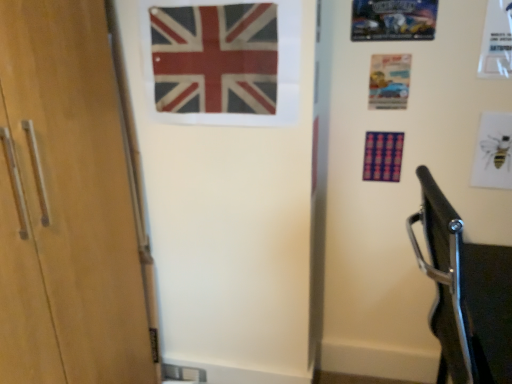
Question: In the image, is metallic silver car at upper right, which is counted as the third postcard, starting from the bottom, on the left side or the right side of white paper bee at upper right, acting as the 3th postcard starting from the left?

Choices:
 (A) right
 (B) left

Answer: (B)

Question: Is metallic silver car at upper right, which is counted as the third postcard, starting from the bottom, taller or shorter than white paper bee at upper right, positioned as the first postcard in bottom-to-top order?

Choices:
 (A) short
 (B) tall

Answer: (A)

Question: Estimate the real-world distances between objects in this image. Which object is closer to the matte paper postcard at upper right, which ranks as the second postcard in bottom-to-top order?

Choices:
 (A) white paper bee at upper right, the third postcard viewed from the top
 (B) red and white fabric flag at upper center
 (C) metallic silver car at upper right, which is the 3th postcard from right to left

Answer: (C)

Question: Estimate the real-world distances between objects in this image. Which object is farther from the metallic silver car at upper right, the 1th postcard in the top-to-bottom sequence?

Choices:
 (A) white paper bee at upper right, placed as the 1th postcard when sorted from right to left
 (B) red and white fabric flag at upper center
 (C) matte paper postcard at upper right, which ranks as the second postcard in bottom-to-top order

Answer: (B)